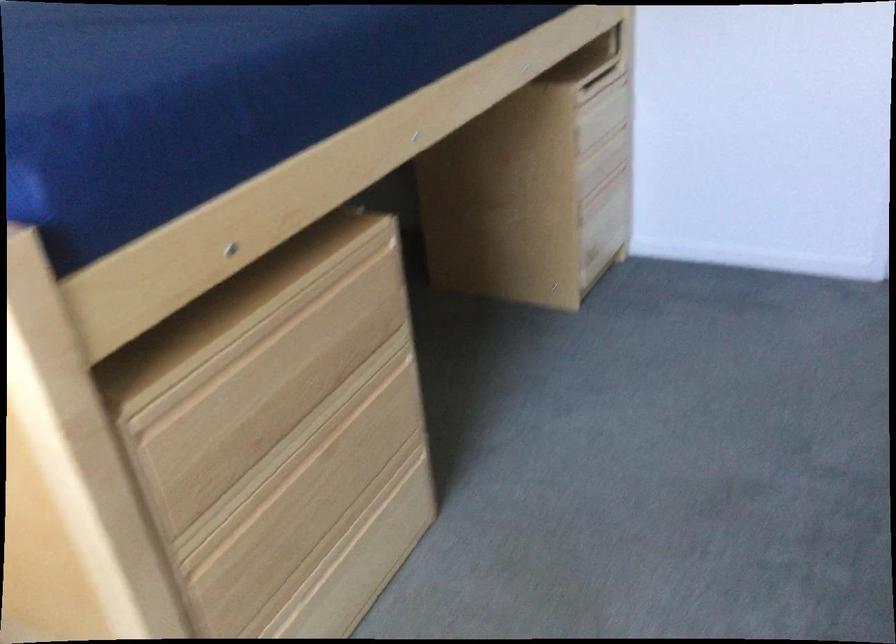
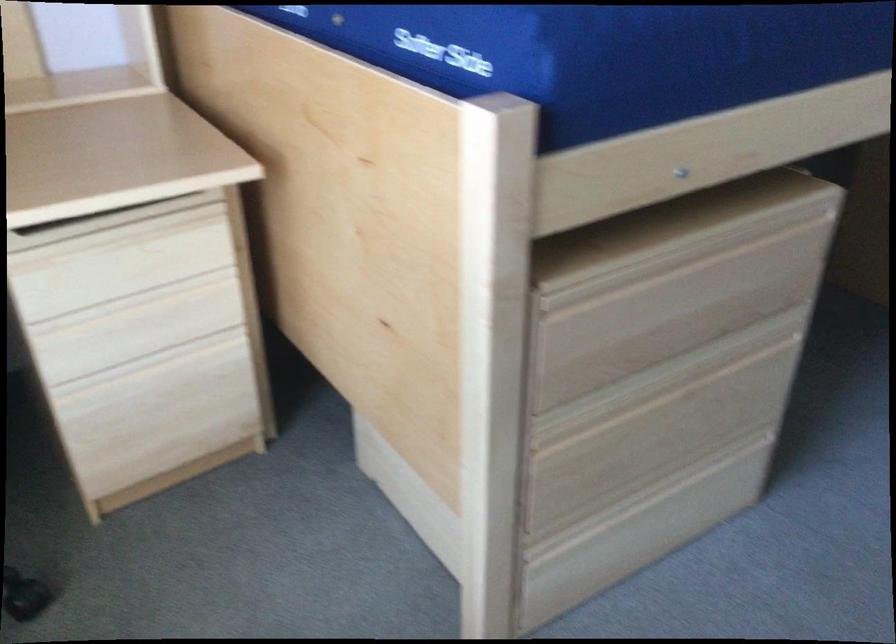
Find the pixel in the second image that matches pixel 307 437 in the first image.

(673, 377)